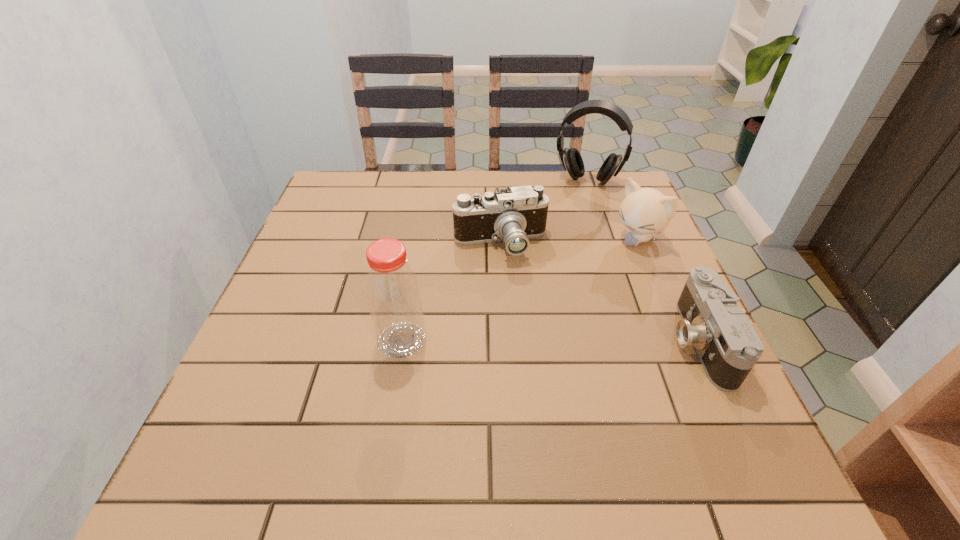
Find the location of a particular element. blank area located 0.370m on the lens of the nearer camera is located at coordinates (492, 341).

You are a GUI agent. You are given a task and a screenshot of the screen. Output one action in this format:
    pyautogui.click(x=<x>, y=<y>)
    Task: Click on the free space located on the face of the third shortest object
    The width and height of the screenshot is (960, 540).
    Given the screenshot: What is the action you would take?
    pyautogui.click(x=570, y=292)

This screenshot has width=960, height=540. Find the location of `blank space located 0.230m on the face of the third shortest object`. blank space located 0.230m on the face of the third shortest object is located at coordinates (567, 294).

Where is `vacant space situated on the face of the third shortest object`? The image size is (960, 540). vacant space situated on the face of the third shortest object is located at coordinates tap(606, 264).

This screenshot has height=540, width=960. Find the location of `free spot located on the ear cups of the earphone`. free spot located on the ear cups of the earphone is located at coordinates coord(576,206).

Find the location of a particular element. This screenshot has width=960, height=540. free spot located 0.200m on the ear cups of the earphone is located at coordinates (568, 231).

The image size is (960, 540). What are the coordinates of `vacant space situated on the ear cups of the earphone` in the screenshot? It's located at (560, 259).

Identify the location of vacant space located at the lens of the farther camera. The width and height of the screenshot is (960, 540). tap(511, 339).

Identify the location of vacant space located 0.160m at the lens of the farther camera. This screenshot has height=540, width=960. (508, 314).

Image resolution: width=960 pixels, height=540 pixels. In order to click on vacant space situated at the lens of the farther camera in this screenshot , I will do `click(517, 415)`.